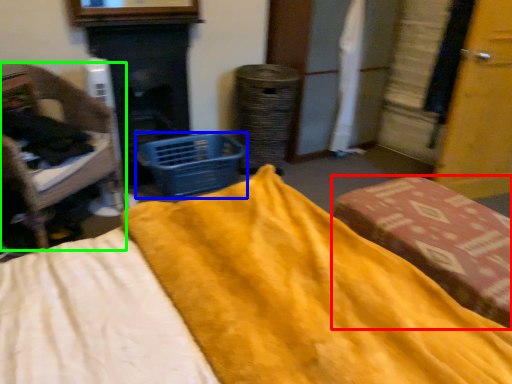
Question: Which object is positioned closest to furniture (highlighted by a red box)? Select from basket (highlighted by a blue box) and furniture (highlighted by a green box).

Choices:
 (A) basket
 (B) furniture

Answer: (A)